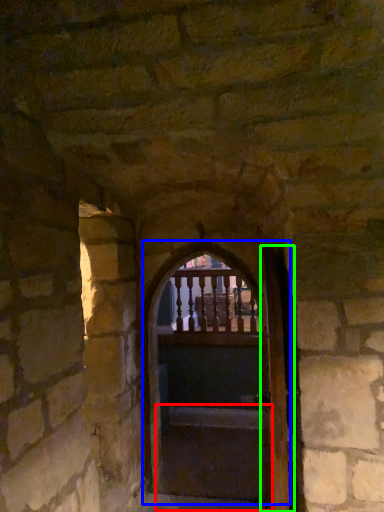
Question: Based on their relative distances, which object is farther from stairs (highlighted by a red box)? Choose from door (highlighted by a blue box) and door (highlighted by a green box).

Choices:
 (A) door
 (B) door

Answer: (B)